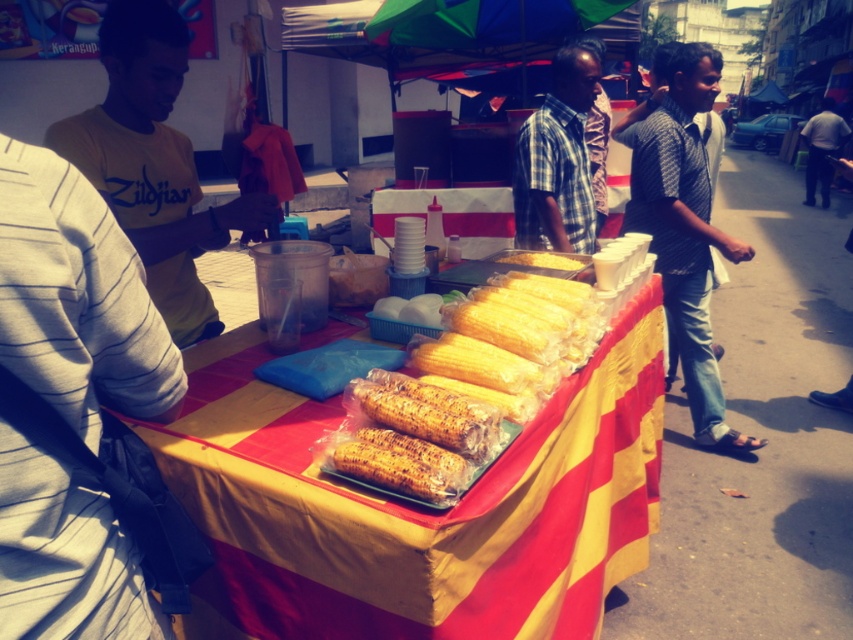
Question: Is light yellow cotton shirt at left smaller than yellow matte corn at center?

Choices:
 (A) no
 (B) yes

Answer: (A)

Question: Among these points, which one is nearest to the camera?

Choices:
 (A) (619, 362)
 (B) (808, 177)
 (C) (149, 51)

Answer: (C)

Question: Which object appears farthest from the camera in this image?

Choices:
 (A) patterned shirt at right
 (B) light yellow cotton shirt at left
 (C) checkered fabric shirt at center

Answer: (C)

Question: Where is light yellow cotton shirt at left located in relation to checkered fabric shirt at center in the image?

Choices:
 (A) left
 (B) right

Answer: (A)

Question: Is light yellow cotton shirt at left to the left of yellow matte corn at center from the viewer's perspective?

Choices:
 (A) no
 (B) yes

Answer: (B)

Question: Among these objects, which one is nearest to the camera?

Choices:
 (A) yellow matte corn at center
 (B) light yellow cotton shirt at left
 (C) patterned shirt at right

Answer: (B)